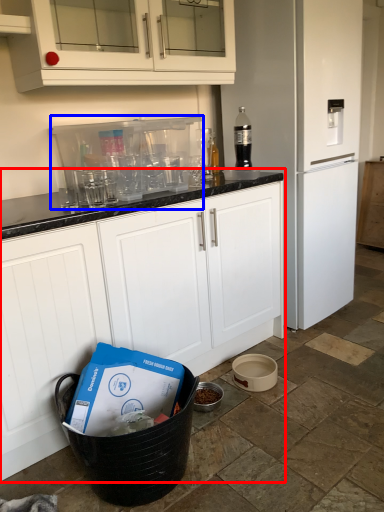
Question: Which object appears closest to the camera in this image, cabinetry (highlighted by a red box) or appliance (highlighted by a blue box)?

Choices:
 (A) cabinetry
 (B) appliance

Answer: (A)